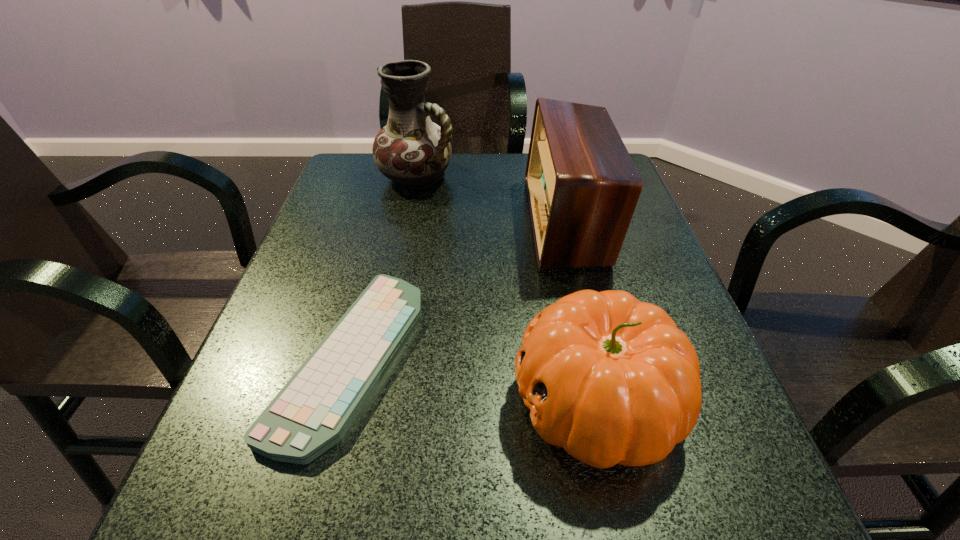
Where is `vacant space located 0.390m on the carved face of the second shortest object`? This screenshot has width=960, height=540. vacant space located 0.390m on the carved face of the second shortest object is located at coordinates (260, 400).

The height and width of the screenshot is (540, 960). I want to click on vacant region located on the right of the shortest object, so click(x=458, y=357).

Where is `vase located in the far edge section of the desktop`? vase located in the far edge section of the desktop is located at coordinates (412, 151).

The height and width of the screenshot is (540, 960). I want to click on radio receiver that is at the far edge, so click(x=582, y=185).

Locate an element on the screen. object that is at the near edge is located at coordinates (612, 380).

Locate an element on the screen. The width and height of the screenshot is (960, 540). vase that is at the left edge is located at coordinates (412, 151).

At what (x,y) coordinates should I click in order to perform the action: click on computer keyboard that is at the left edge. Please return your answer as a coordinate pair (x, y). The image size is (960, 540). Looking at the image, I should click on (313, 411).

Identify the location of radio receiver situated at the right edge. The height and width of the screenshot is (540, 960). (582, 185).

I want to click on pumpkin situated at the right edge, so click(x=612, y=380).

Locate an element on the screen. This screenshot has height=540, width=960. object that is at the far left corner is located at coordinates (412, 151).